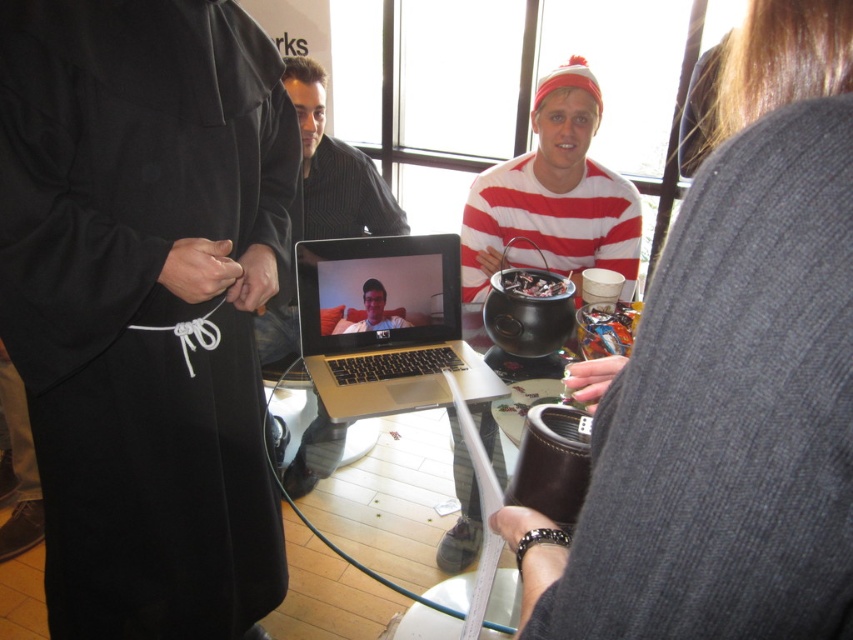
Does black matte robe at left appear over matte black laptop at center?

No.

Is black matte robe at left wider than matte black laptop at center?

Correct, the width of black matte robe at left exceeds that of matte black laptop at center.

Does point (143, 99) come in front of point (352, 324)?

That is True.

Locate an element on the screen. black matte robe at left is located at coordinates (144, 304).

Does black matte cauldron at center have a smaller size compared to matte black laptop at center?

No, black matte cauldron at center is not smaller than matte black laptop at center.

Does black matte cauldron at center appear on the left side of matte black laptop at center?

In fact, black matte cauldron at center is to the right of matte black laptop at center.

Is point (521, 177) behind point (341, 332)?

Yes, point (521, 177) is behind point (341, 332).

You are a GUI agent. You are given a task and a screenshot of the screen. Output one action in this format:
    pyautogui.click(x=<x>, y=<y>)
    Task: Click on the black matte cauldron at center
    The width and height of the screenshot is (853, 640).
    Given the screenshot: What is the action you would take?
    pyautogui.click(x=549, y=224)

Is gold metallic laptop at center positioned at the back of matte black laptop at center?

No.

Between point (364, 269) and point (381, 298), which one is positioned in front?

Point (364, 269) is in front.

The image size is (853, 640). In order to click on gold metallic laptop at center in this screenshot , I will do `click(386, 324)`.